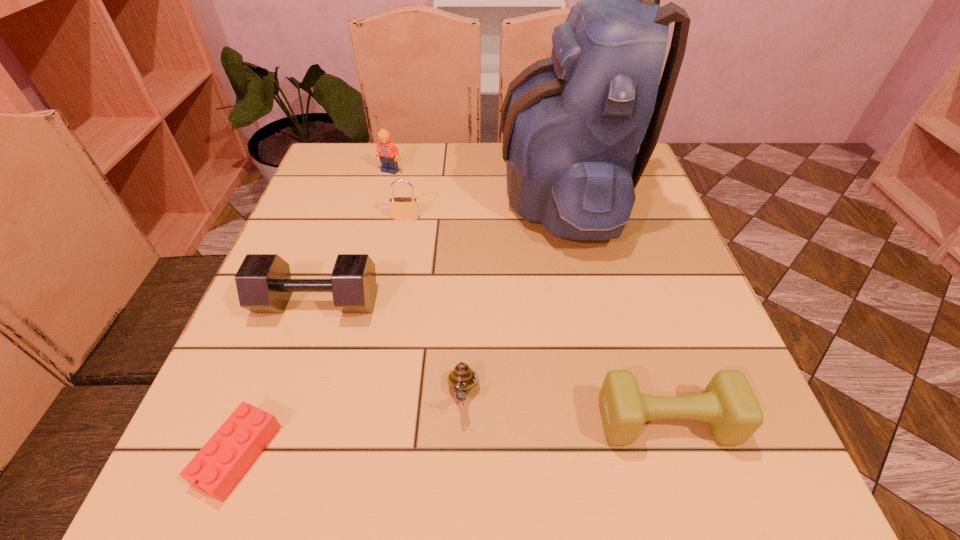
The width and height of the screenshot is (960, 540). What are the coordinates of `vacant point that satisfies the following two spatial constraints: 1. on the back side of the shorter dumbbell; 2. at the front pocket of the backpack` in the screenshot? It's located at (596, 193).